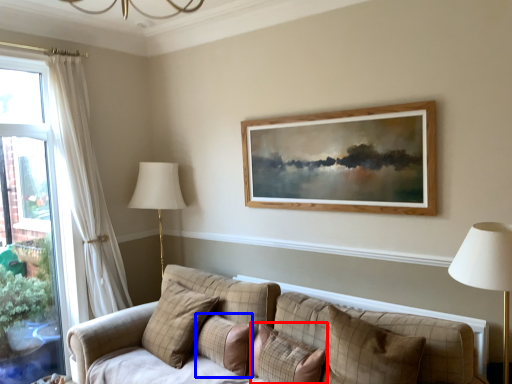
Question: Which object appears farthest to the camera in this image, pillow (highlighted by a red box) or pillow (highlighted by a blue box)?

Choices:
 (A) pillow
 (B) pillow

Answer: (B)